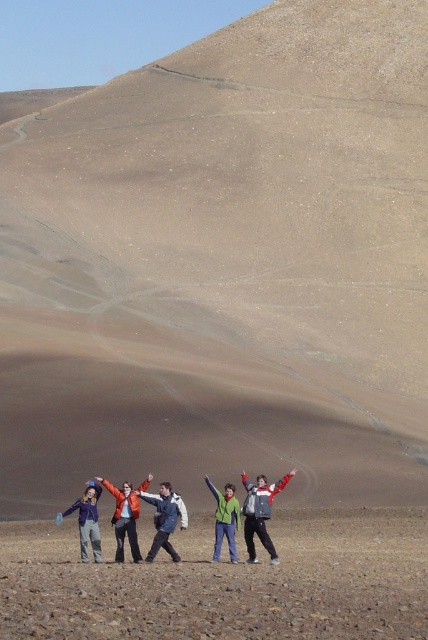
Question: Considering the relative positions of brown sandy ground at lower center and matte orange jacket at lower left in the image provided, where is brown sandy ground at lower center located with respect to matte orange jacket at lower left?

Choices:
 (A) right
 (B) left

Answer: (A)

Question: Among these objects, which one is farthest from the camera?

Choices:
 (A) matte blue jacket at lower left
 (B) brown sandy ground at lower center

Answer: (A)

Question: Which object is positioned closest to the brown sandy ground at lower center?

Choices:
 (A) gray fabric arm at center
 (B) matte black jacket at lower left

Answer: (A)

Question: Is green matte jacket at center below gray fabric arm at center?

Choices:
 (A) yes
 (B) no

Answer: (A)

Question: Does red jacket at center have a smaller size compared to green fabric arm at center?

Choices:
 (A) yes
 (B) no

Answer: (B)

Question: Estimate the real-world distances between objects in this image. Which object is farther from the orange jacket at center?

Choices:
 (A) matte blue jacket at lower left
 (B) green fabric arm at center

Answer: (B)